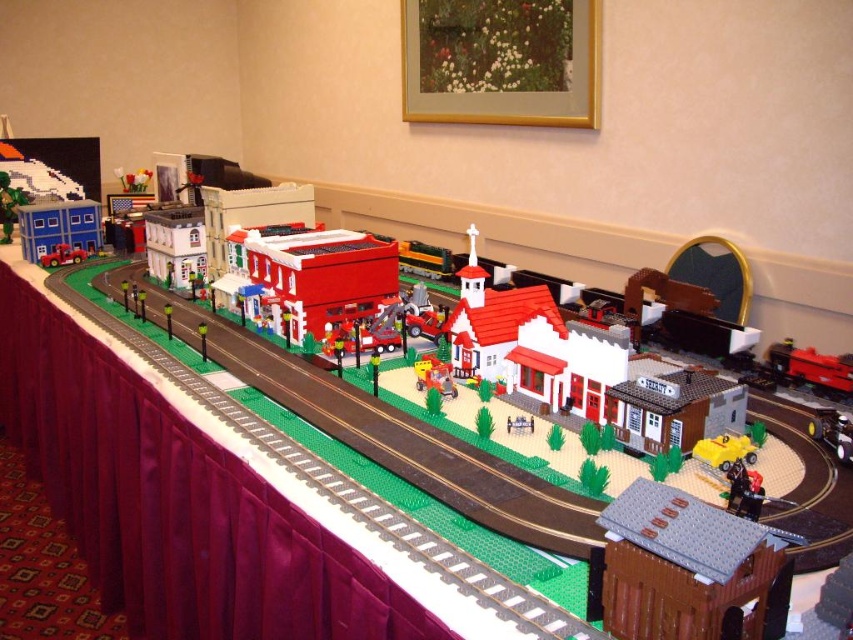
How much distance is there between brown matte building at lower right and matte red truck at center?

They are 2.60 meters apart.

How distant is brown matte building at lower right from matte red truck at center?

brown matte building at lower right is 8.53 feet away from matte red truck at center.

Between point (685, 532) and point (57, 252), which one is positioned behind?

The point (57, 252) is behind.

This screenshot has width=853, height=640. In order to click on brown matte building at lower right in this screenshot , I will do `click(689, 568)`.

How distant is matte blue building at left from matte plastic train car at center?

matte blue building at left is 2.21 meters away from matte plastic train car at center.

Can you confirm if matte blue building at left is wider than matte plastic train car at center?

Correct, the width of matte blue building at left exceeds that of matte plastic train car at center.

Between point (76, 248) and point (531, 428), which one is positioned in front?

Point (531, 428)

This screenshot has height=640, width=853. Identify the location of matte blue building at left. (59, 230).

Between matte blue building at left and matte black train car at left, which one appears on the left side from the viewer's perspective?

matte black train car at left

From the picture: Is matte blue building at left to the right of matte black train car at left from the viewer's perspective?

Indeed, matte blue building at left is positioned on the right side of matte black train car at left.

Does point (73, 234) come farther from viewer compared to point (9, 221)?

No, (73, 234) is in front of (9, 221).

This screenshot has height=640, width=853. In order to click on matte blue building at left in this screenshot , I will do `click(59, 230)`.